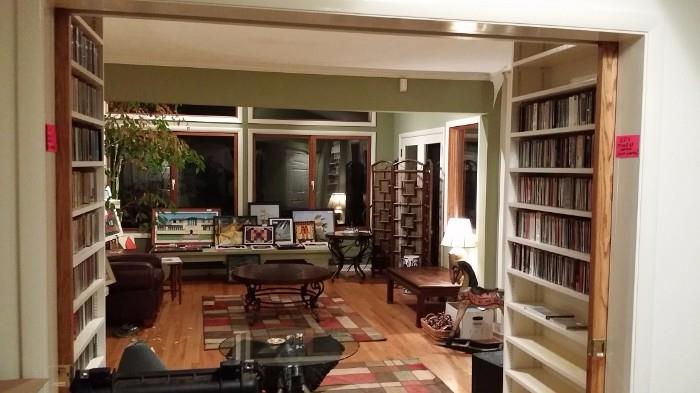
Find the location of a particular element. circular wooden table is located at coordinates (287, 274).